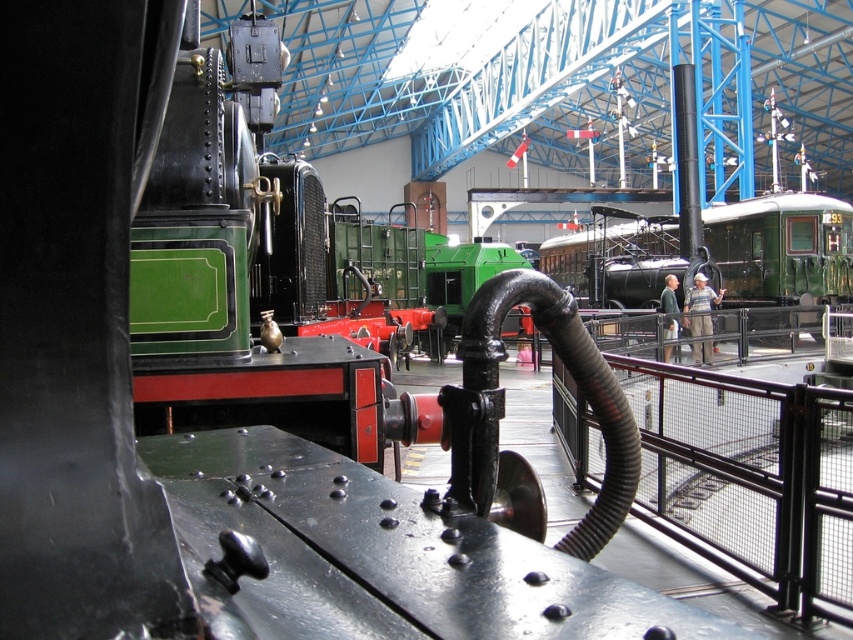
Question: Can you confirm if black metal rail at center is wider than green polished wood train at center?

Choices:
 (A) yes
 (B) no

Answer: (B)

Question: Observing the image, what is the correct spatial positioning of black metal rail at center in reference to green polished wood train at center?

Choices:
 (A) above
 (B) below

Answer: (B)

Question: Does black metal rail at center have a larger size compared to green polished wood train at center?

Choices:
 (A) no
 (B) yes

Answer: (A)

Question: Which point appears closest to the camera in this image?

Choices:
 (A) (711, 502)
 (B) (624, 291)

Answer: (A)

Question: Which point appears closest to the camera in this image?

Choices:
 (A) (793, 275)
 (B) (804, 461)

Answer: (B)